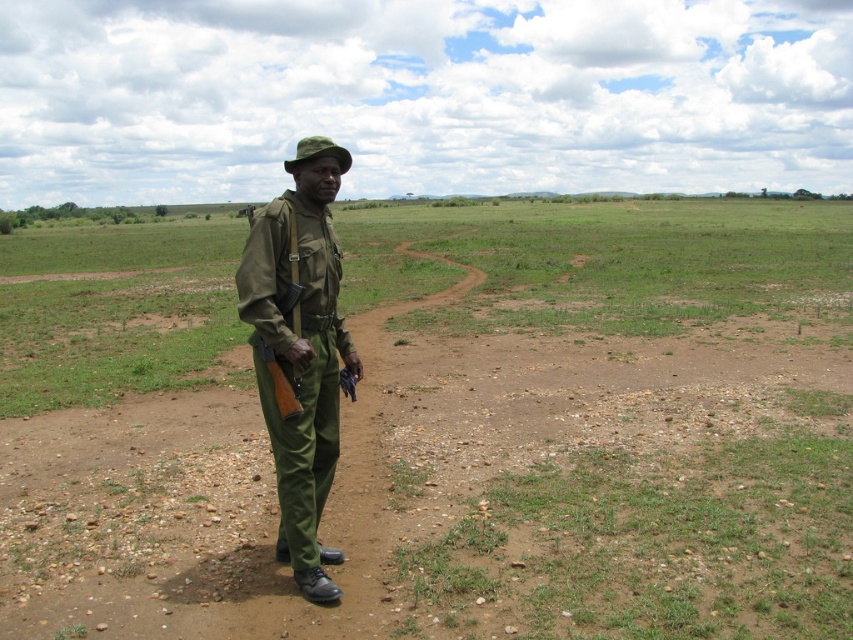
Question: Does green uniform at center have a lesser width compared to matte green uniform at center?

Choices:
 (A) yes
 (B) no

Answer: (B)

Question: Can you confirm if green uniform at center is positioned to the right of matte green uniform at center?

Choices:
 (A) yes
 (B) no

Answer: (B)

Question: Does green uniform at center appear on the left side of matte green uniform at center?

Choices:
 (A) no
 (B) yes

Answer: (B)

Question: Which point is closer to the camera?

Choices:
 (A) (248, 602)
 (B) (299, 282)

Answer: (A)